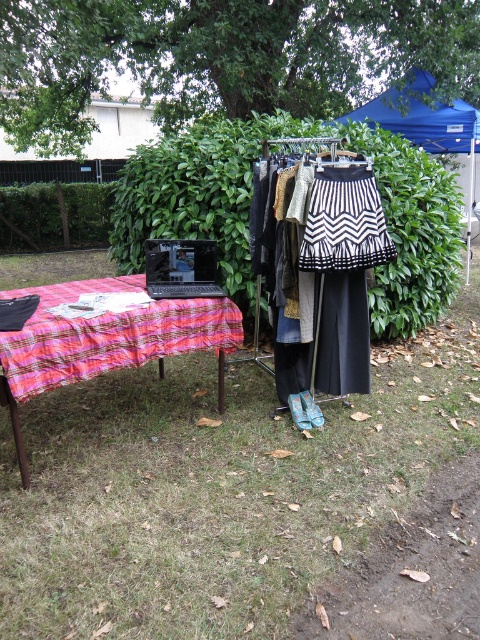
Question: Can you confirm if plaid fabric picnic table at left is wider than blue fabric canopy at upper right?

Choices:
 (A) yes
 (B) no

Answer: (B)

Question: Among these objects, which one is nearest to the camera?

Choices:
 (A) green grass at lower center
 (B) plaid fabric picnic table at left

Answer: (A)

Question: Estimate the real-world distances between objects in this image. Which object is closer to the green grass at lower center?

Choices:
 (A) plaid fabric picnic table at left
 (B) blue fabric canopy at upper right

Answer: (A)

Question: Does green grass at lower center appear over blue fabric canopy at upper right?

Choices:
 (A) yes
 (B) no

Answer: (B)

Question: Which object is the closest to the blue fabric canopy at upper right?

Choices:
 (A) plaid fabric picnic table at left
 (B) green grass at lower center

Answer: (B)

Question: Observing the image, what is the correct spatial positioning of green grass at lower center in reference to blue fabric canopy at upper right?

Choices:
 (A) left
 (B) right

Answer: (A)